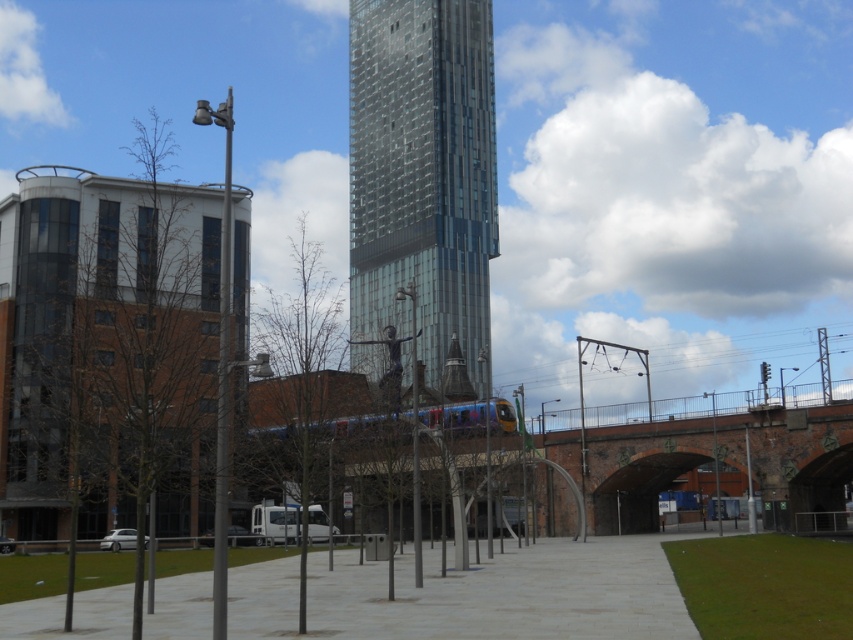
You are an architect evaluating the urban layout. Considering the glassy metallic skyscraper at center and the brick archway at center, which structure occupies more visual space in the image?

The glassy metallic skyscraper at center is larger in size than the brick archway at center, so it occupies more visual space in the image.

Based on the photo, you are a city planner assessing the distance between two key structures in the image. The glassy metallic skyscraper at center and the brick archway at center are both important landmarks. Given that the minimum required distance for safety regulations between such structures is 200 feet, does the current spacing meet the requirement?

The glassy metallic skyscraper at center and brick archway at center are 211.47 feet apart, which exceeds the 200 feet safety regulation requirement. Therefore, the current spacing meets the requirement.

You are standing at the point marked by point (422, 172) in the urban scene. What is the closest major structure to you?

The point (422, 172) marks the glassy metallic skyscraper at center, so the closest major structure to you is the glassy metallic skyscraper at center.